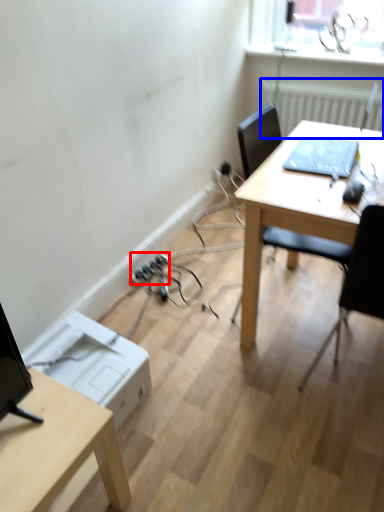
Question: Which of the following is the farthest to the observer, extension cord (highlighted by a red box) or radiator (highlighted by a blue box)?

Choices:
 (A) extension cord
 (B) radiator

Answer: (A)